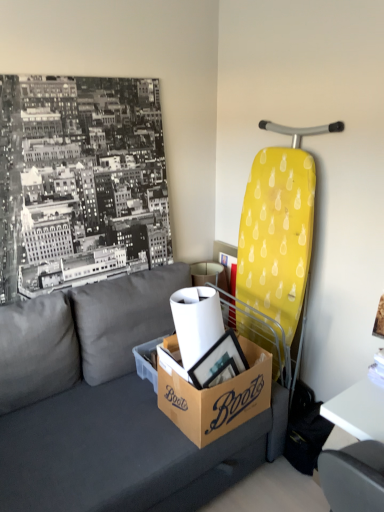
Question: Is white glossy table at lower right aimed at brown cardboard box at lower center?

Choices:
 (A) no
 (B) yes

Answer: (A)

Question: From a real-world perspective, is white glossy table at lower right located higher than brown cardboard box at lower center?

Choices:
 (A) no
 (B) yes

Answer: (A)

Question: From the image's perspective, is white glossy table at lower right located above brown cardboard box at lower center?

Choices:
 (A) no
 (B) yes

Answer: (A)

Question: Considering the relative sizes of white glossy table at lower right and brown cardboard box at lower center in the image provided, is white glossy table at lower right bigger than brown cardboard box at lower center?

Choices:
 (A) no
 (B) yes

Answer: (B)

Question: From the image's perspective, is white glossy table at lower right located beneath brown cardboard box at lower center?

Choices:
 (A) yes
 (B) no

Answer: (A)

Question: In terms of size, does brown cardboard box at lower center appear bigger or smaller than brown cardboard box at center?

Choices:
 (A) big
 (B) small

Answer: (B)

Question: Which is correct: brown cardboard box at lower center is inside brown cardboard box at center, or outside of it?

Choices:
 (A) outside
 (B) inside

Answer: (A)

Question: Is brown cardboard box at lower center wider or thinner than brown cardboard box at center?

Choices:
 (A) wide
 (B) thin

Answer: (B)

Question: Would you say brown cardboard box at lower center is to the left or to the right of brown cardboard box at center in the picture?

Choices:
 (A) right
 (B) left

Answer: (B)

Question: Does point coord(162,354) appear closer or farther from the camera than point coord(375,443)?

Choices:
 (A) closer
 (B) farther

Answer: (B)

Question: Based on their positions, is brown cardboard box at center located to the left or right of white glossy table at lower right?

Choices:
 (A) right
 (B) left

Answer: (B)

Question: Relative to white glossy table at lower right, is brown cardboard box at center in front or behind?

Choices:
 (A) behind
 (B) front

Answer: (B)

Question: From the image's perspective, relative to white glossy table at lower right, is brown cardboard box at center above or below?

Choices:
 (A) below
 (B) above

Answer: (B)

Question: Is point (112, 352) positioned closer to the camera than point (137, 349)?

Choices:
 (A) farther
 (B) closer

Answer: (A)

Question: Considering the positions of dark gray fabric couch at center and brown cardboard box at lower center in the image, is dark gray fabric couch at center bigger or smaller than brown cardboard box at lower center?

Choices:
 (A) small
 (B) big

Answer: (B)